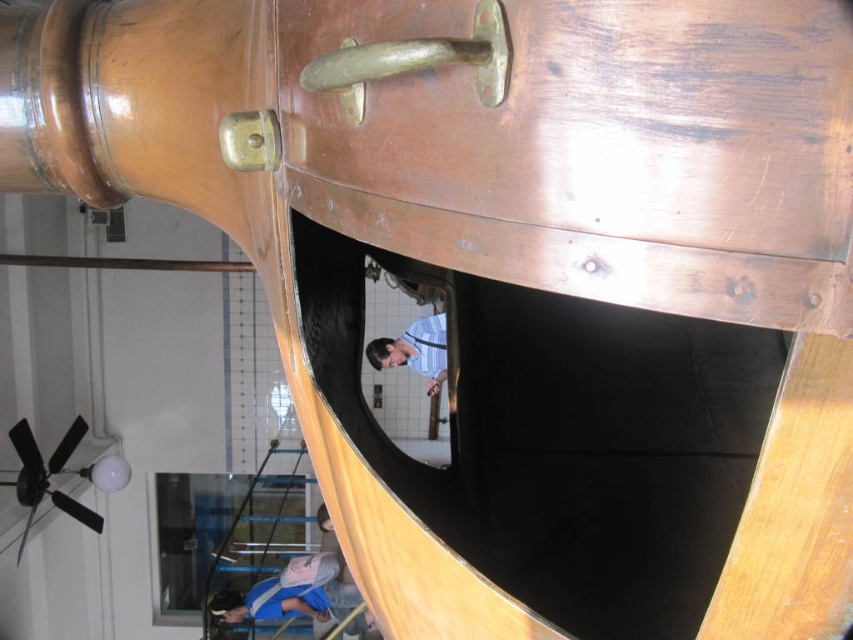
You are standing in front of the copper vat and see two points marked on its surface. Which point is closer to you, point [419,61] or point [258,140]?

Point [419,61] is closer to the viewer than point [258,140].